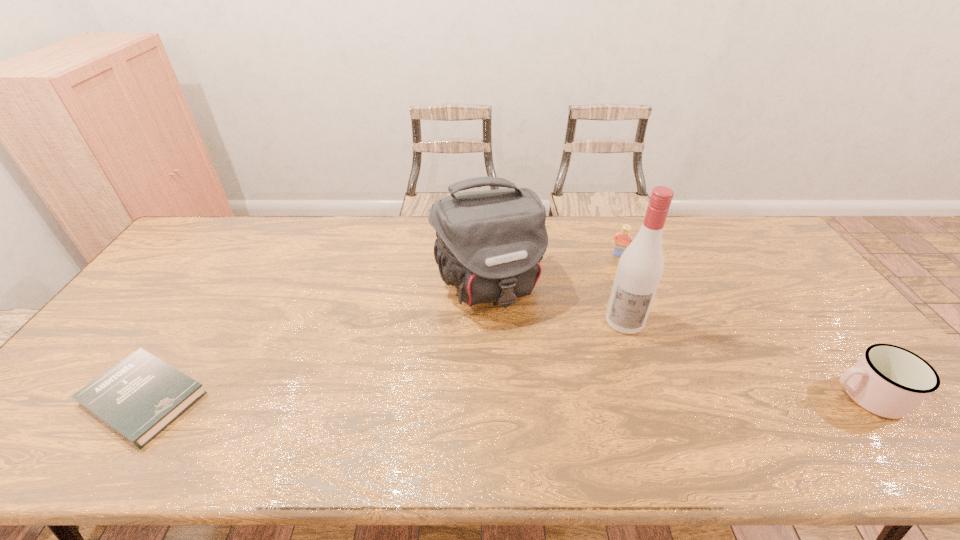
At what (x,y) coordinates should I click in order to perform the action: click on the leftmost object. Please return your answer as a coordinate pair (x, y). Looking at the image, I should click on (139, 397).

At what (x,y) coordinates should I click in order to perform the action: click on the shortest object. Please return your answer as a coordinate pair (x, y). This screenshot has height=540, width=960. Looking at the image, I should click on (139, 397).

Where is `mug`? The width and height of the screenshot is (960, 540). mug is located at coordinates (889, 381).

Identify the location of shoulder bag. (489, 244).

What are the coordinates of `the fourth object from right to left` in the screenshot? It's located at (489, 244).

Find the location of `alcohol`. alcohol is located at coordinates (640, 268).

Where is `Lego`? This screenshot has width=960, height=540. Lego is located at coordinates (624, 238).

Locate an element on the screen. The height and width of the screenshot is (540, 960). vacant region located on the back of the book is located at coordinates (212, 296).

The width and height of the screenshot is (960, 540). Find the location of `free spot located 0.350m on the side of the rightmost object with the handle`. free spot located 0.350m on the side of the rightmost object with the handle is located at coordinates (684, 396).

Identify the location of vacant region located 0.250m on the side of the rightmost object with the handle. (725, 396).